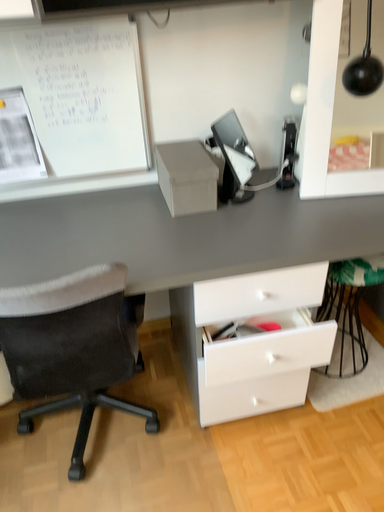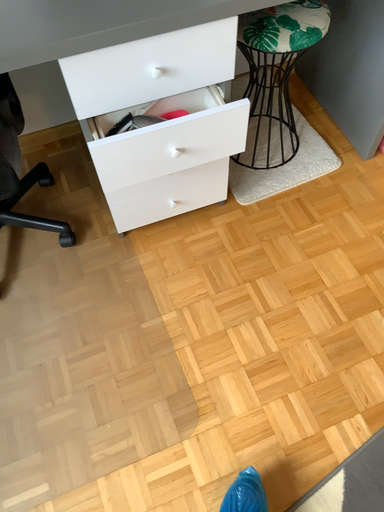
Question: Which way did the camera rotate in the video?

Choices:
 (A) rotated upward
 (B) rotated downward

Answer: (B)